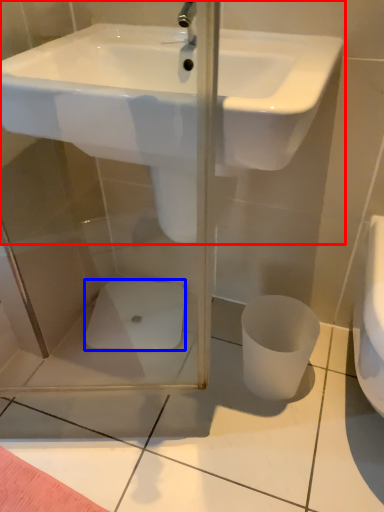
Question: Which of the following is the farthest to the observer, sink (highlighted by a red box) or porcelain (highlighted by a blue box)?

Choices:
 (A) sink
 (B) porcelain

Answer: (B)